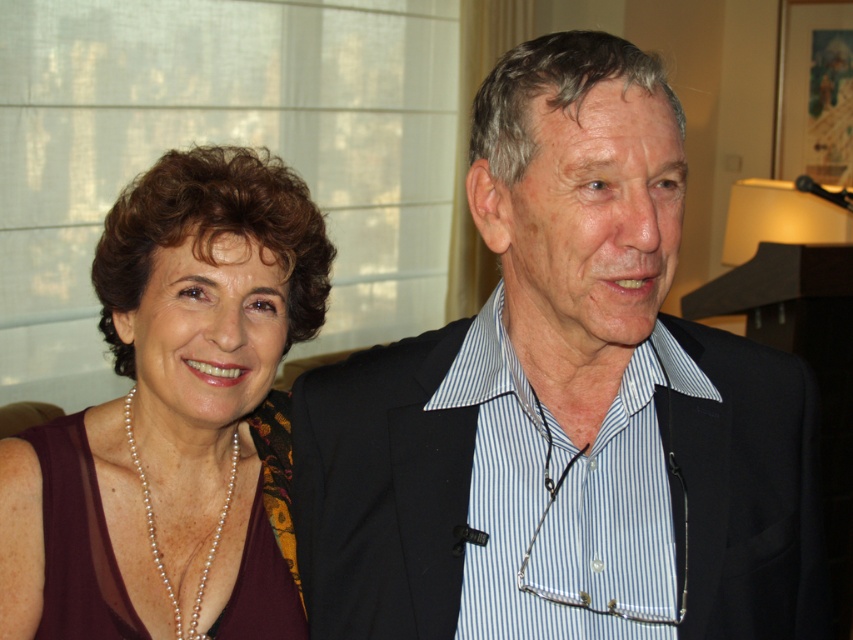
Question: Does black striped shirt at center appear over maroon fabric dress at left?

Choices:
 (A) yes
 (B) no

Answer: (A)

Question: Considering the relative positions of black striped shirt at center and maroon fabric dress at left in the image provided, where is black striped shirt at center located with respect to maroon fabric dress at left?

Choices:
 (A) below
 (B) above

Answer: (B)

Question: Can you confirm if black striped shirt at center is bigger than maroon fabric dress at left?

Choices:
 (A) no
 (B) yes

Answer: (B)

Question: Which object appears closest to the camera in this image?

Choices:
 (A) black striped shirt at center
 (B) maroon fabric dress at left

Answer: (A)